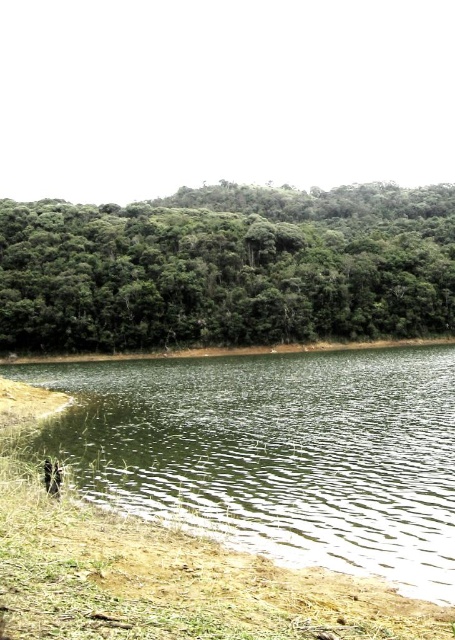
Question: Does green liquid water at lower center appear under brown fur animal at lower left?

Choices:
 (A) no
 (B) yes

Answer: (B)

Question: Which object appears closest to the camera in this image?

Choices:
 (A) green liquid water at lower center
 (B) brown fur animal at lower left

Answer: (A)

Question: Among these points, which one is nearest to the camera?

Choices:
 (A) (213, 275)
 (B) (344, 522)
 (C) (56, 467)

Answer: (B)

Question: Which point is farther to the camera?

Choices:
 (A) green leafy trees at upper center
 (B) brown fur animal at lower left

Answer: (A)

Question: Does green liquid water at lower center appear over brown fur animal at lower left?

Choices:
 (A) no
 (B) yes

Answer: (A)

Question: In this image, where is green liquid water at lower center located relative to brown fur animal at lower left?

Choices:
 (A) right
 (B) left

Answer: (A)